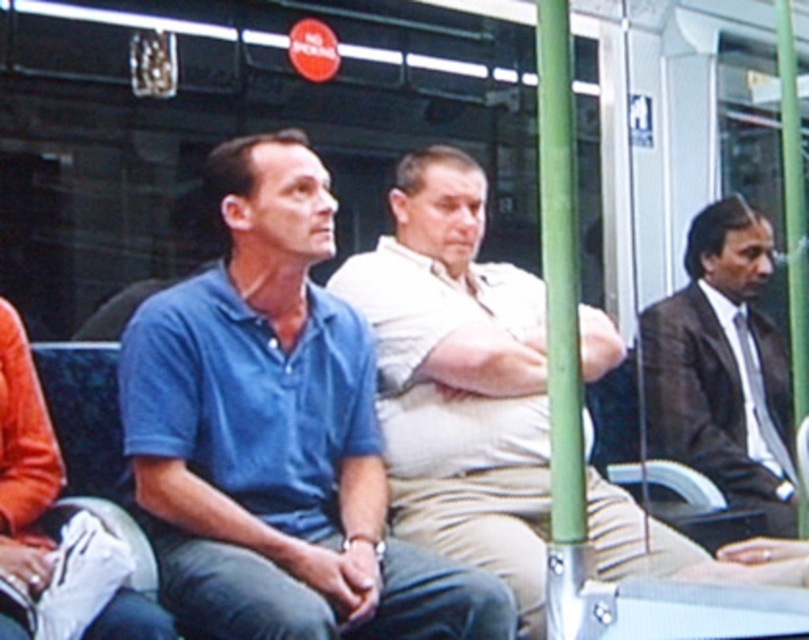
Question: Which point appears closest to the camera in this image?

Choices:
 (A) (748, 316)
 (B) (532, 632)
 (C) (215, 172)

Answer: (B)

Question: Which object is farther from the camera taking this photo?

Choices:
 (A) dark brown suit at right
 (B) blue cotton shirt at center
 (C) beige cotton shirt at center

Answer: (A)

Question: Which of these objects is positioned farthest from the dark brown suit at right?

Choices:
 (A) beige cotton shirt at center
 (B) blue cotton shirt at center

Answer: (B)

Question: Is blue cotton shirt at center wider than dark brown suit at right?

Choices:
 (A) yes
 (B) no

Answer: (A)

Question: Does beige cotton shirt at center have a larger size compared to dark brown suit at right?

Choices:
 (A) no
 (B) yes

Answer: (B)

Question: Is blue cotton shirt at center to the right of beige cotton shirt at center from the viewer's perspective?

Choices:
 (A) no
 (B) yes

Answer: (A)